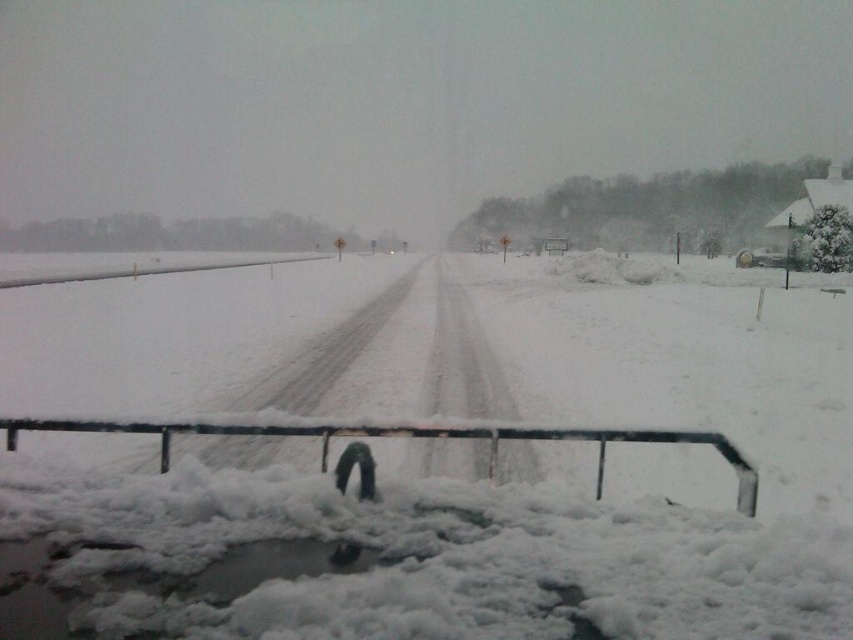
Question: Is white fluffy snow at center above black metal rail at center?

Choices:
 (A) no
 (B) yes

Answer: (B)

Question: Which object is farther from the camera taking this photo?

Choices:
 (A) white fluffy snow at center
 (B) white matte rail at left
 (C) black metal rail at center

Answer: (B)

Question: Does white fluffy snow at center appear over white matte rail at left?

Choices:
 (A) no
 (B) yes

Answer: (A)

Question: Which of the following is the farthest from the observer?

Choices:
 (A) black metal rail at center
 (B) white matte rail at left

Answer: (B)

Question: Is black metal rail at center in front of white matte rail at left?

Choices:
 (A) no
 (B) yes

Answer: (B)

Question: Among these objects, which one is nearest to the camera?

Choices:
 (A) white matte rail at left
 (B) white fluffy snow at center

Answer: (B)